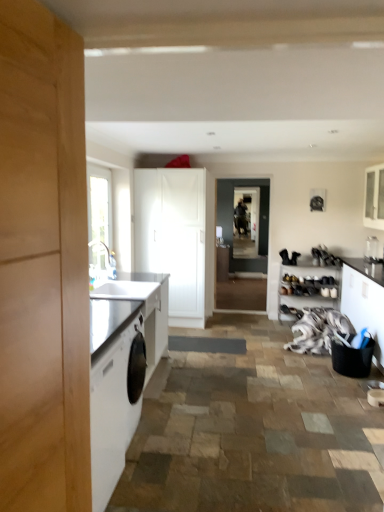
Where is `vacant space situated above dark gray matte screen door at center, the second screen door positioned from the right (from a real-world perspective)`? Image resolution: width=384 pixels, height=512 pixels. vacant space situated above dark gray matte screen door at center, the second screen door positioned from the right (from a real-world perspective) is located at coordinates (241, 175).